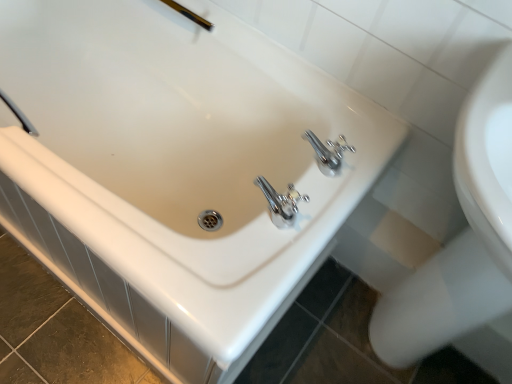
Question: From a real-world perspective, is gold metallic shower head at upper center physically located above or below white glossy sink at upper right?

Choices:
 (A) above
 (B) below

Answer: (A)

Question: Is point (202, 26) positioned closer to the camera than point (475, 304)?

Choices:
 (A) closer
 (B) farther

Answer: (B)

Question: Considering the real-world distances, which object is farthest from the white glossy sink at upper right?

Choices:
 (A) gold metallic shower head at upper center
 (B) white glossy bidet at lower right

Answer: (A)

Question: Which object is the closest to the white glossy sink at upper right?

Choices:
 (A) white glossy bidet at lower right
 (B) gold metallic shower head at upper center

Answer: (A)